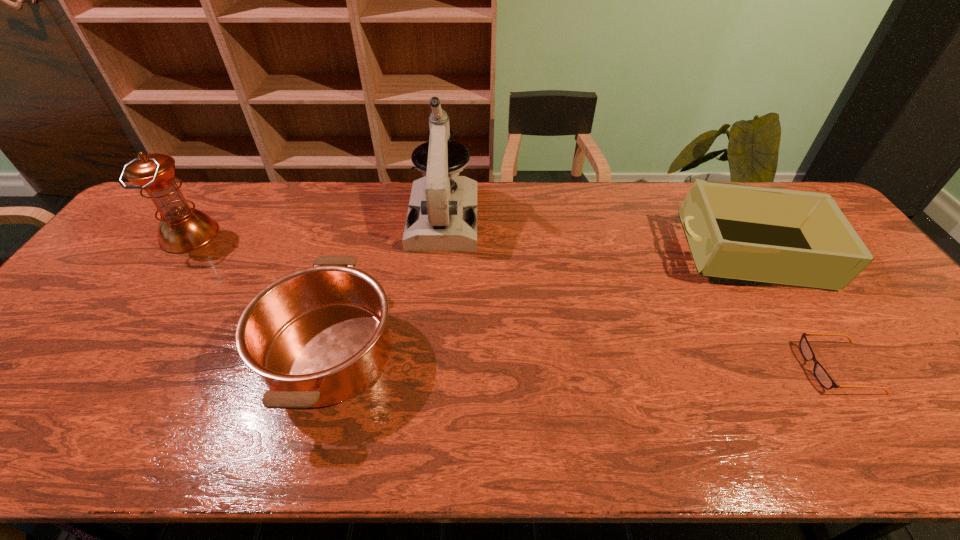
Locate an element on the screen. the tallest object is located at coordinates (442, 215).

Where is `the leftmost object`? This screenshot has height=540, width=960. the leftmost object is located at coordinates (182, 229).

Image resolution: width=960 pixels, height=540 pixels. Identify the location of oil lamp. (182, 229).

The height and width of the screenshot is (540, 960). I want to click on the third shortest object, so click(785, 237).

At what (x,y) coordinates should I click in order to perform the action: click on saucepan. Please return your answer as a coordinate pair (x, y). This screenshot has height=540, width=960. Looking at the image, I should click on (318, 336).

The height and width of the screenshot is (540, 960). In order to click on spectacles in this screenshot , I will do `click(820, 373)`.

Locate an element on the screen. vacant space positioned 0.190m at the eyepiece of the tallest object is located at coordinates [436, 299].

At what (x,y) coordinates should I click in order to perform the action: click on vacant area situated on the back of the fourth shortest object. Please return your answer as a coordinate pair (x, y). Looking at the image, I should click on (225, 186).

The image size is (960, 540). I want to click on vacant space situated 0.380m on the left of the box, so click(544, 256).

The width and height of the screenshot is (960, 540). Find the location of `vacant space situated 0.370m on the back of the fourth tallest object`. vacant space situated 0.370m on the back of the fourth tallest object is located at coordinates (371, 206).